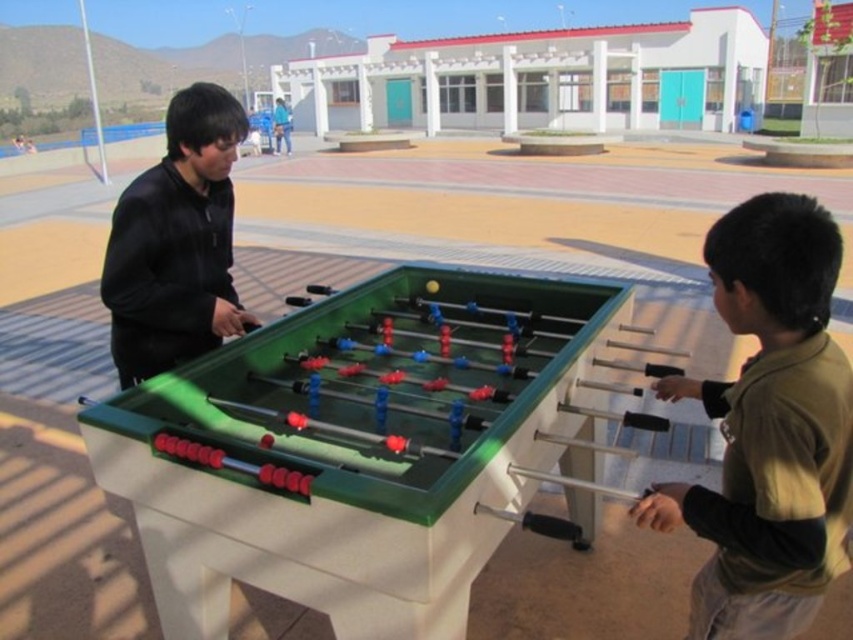
You are a photographer trying to capture a photo of the light brown fleece jacket at lower right and the black matte jacket at center. Since you want to ensure both jackets are clearly visible in the frame, which jacket should you focus on first to account for their sizes?

The light brown fleece jacket at lower right is taller than the black matte jacket at center, so you should focus on the light brown fleece jacket at lower right first to ensure its full height is captured before adjusting the frame for the smaller jacket.

You are standing in front of the foosball table and want to place a small sticker on the point that is closer to you. Which point should you choose between point [820,445] and point [225,323]?

Point [820,445] is closer to the camera than point [225,323], so you should choose point [820,445] to place the sticker.

You are a photographer trying to capture a photo of the two people playing foosball. You notice the light brown fleece jacket at lower right and the black matte jacket at center. Which jacket should you focus on to ensure it appears larger in the photo?

The light brown fleece jacket at lower right is below the black matte jacket at center. Since objects closer to the camera appear larger, focusing on the light brown fleece jacket at lower right would make it appear larger in the photo.